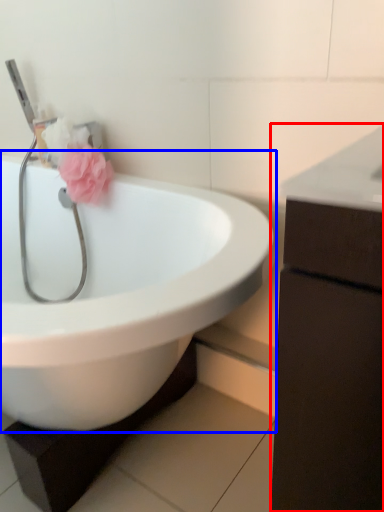
Question: Among these objects, which one is farthest to the camera, bathroom cabinet (highlighted by a red box) or sink (highlighted by a blue box)?

Choices:
 (A) bathroom cabinet
 (B) sink

Answer: (B)